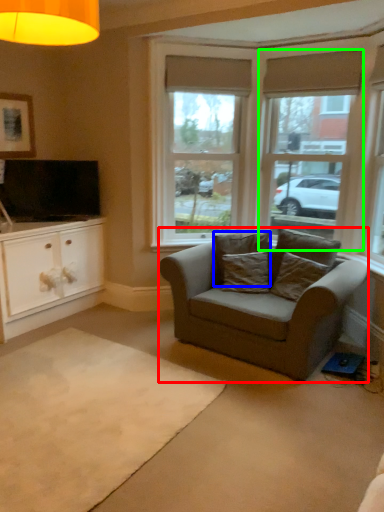
Question: Which is farther away from studio couch (highlighted by a red box)? pillow (highlighted by a blue box) or window (highlighted by a green box)?

Choices:
 (A) pillow
 (B) window

Answer: (B)